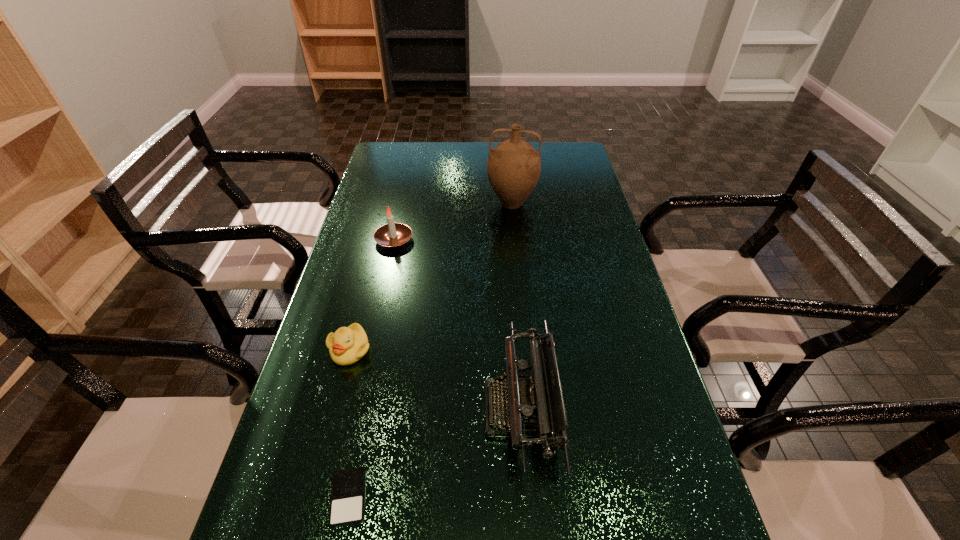
Image resolution: width=960 pixels, height=540 pixels. In order to click on unoccupied area between the shortest object and the typewriter in this screenshot , I will do `click(435, 453)`.

Locate an element on the screen. The height and width of the screenshot is (540, 960). vacant area between the duckling and the second farthest object is located at coordinates (372, 294).

Find the location of `vacant point located between the typewriter and the duckling`. vacant point located between the typewriter and the duckling is located at coordinates [x=436, y=379].

This screenshot has width=960, height=540. In order to click on free space that is in between the farthest object and the iPod in this screenshot , I will do `click(430, 350)`.

Locate an element on the screen. vacant area between the farthest object and the iPod is located at coordinates (430, 350).

Find the location of a particular element. empty space between the fourth tallest object and the iPod is located at coordinates (349, 423).

You are a GUI agent. You are given a task and a screenshot of the screen. Output one action in this format:
    pyautogui.click(x=<x>, y=<y>)
    Task: Click on the free spot between the fourth tallest object and the shortest object
    
    Given the screenshot: What is the action you would take?
    pyautogui.click(x=349, y=423)

Locate an element on the screen. blank region between the tallest object and the fourth nearest object is located at coordinates (453, 221).

I want to click on vacant area between the second farthest object and the farthest object, so click(453, 221).

Where is `the fourth closest object relative to the duckling`? This screenshot has width=960, height=540. the fourth closest object relative to the duckling is located at coordinates (514, 166).